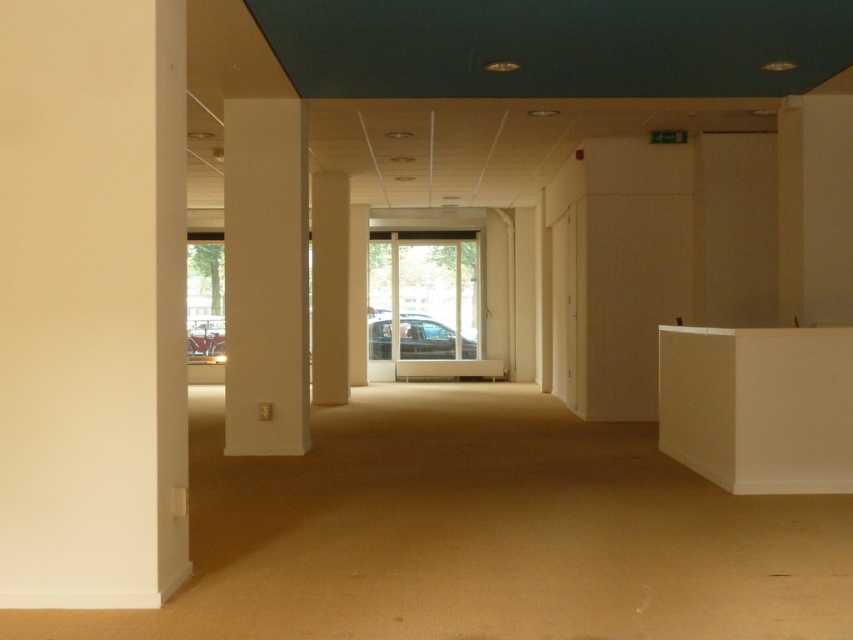
You are a delivery person entering the room and need to place a package on the white matte reception desk at right. However, there is a white smooth pillar at left blocking your path. Can you walk around the pillar to reach the desk?

The white matte reception desk at right is in front of the white smooth pillar at left, meaning the pillar is between you and the desk. To reach the desk, you would need to go around the pillar, but since the pillar is at the left and the desk is at the right, you can walk around the left side of the pillar to access the desk.

You are a maintenance worker in a building and need to replace a light fixture. You see two pillars in the image, the white smooth pillar at left and the white glossy pillar at center. Which pillar is shorter?

The white smooth pillar at left is shorter than the white glossy pillar at center.